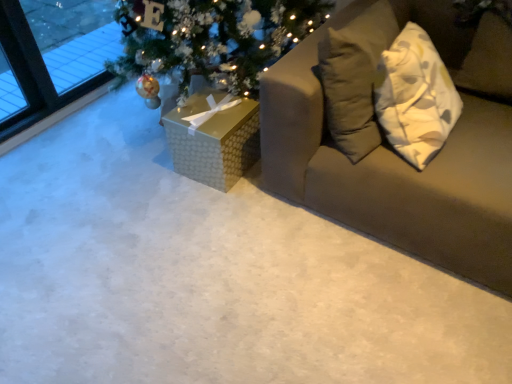
Question: From their relative heights in the image, would you say textured beige couch at right is taller or shorter than gold textured gift box at center?

Choices:
 (A) tall
 (B) short

Answer: (A)

Question: Considering the positions of textured beige couch at right and gold textured gift box at center in the image, is textured beige couch at right bigger or smaller than gold textured gift box at center?

Choices:
 (A) big
 (B) small

Answer: (A)

Question: From the image's perspective, relative to gold textured gift box at center, is textured beige couch at right above or below?

Choices:
 (A) below
 (B) above

Answer: (B)

Question: In terms of width, does gold textured gift box at center look wider or thinner when compared to textured beige couch at right?

Choices:
 (A) thin
 (B) wide

Answer: (A)

Question: Is point (195, 96) positioned closer to the camera than point (293, 160)?

Choices:
 (A) farther
 (B) closer

Answer: (A)

Question: Based on their sizes in the image, would you say gold textured gift box at center is bigger or smaller than textured beige couch at right?

Choices:
 (A) big
 (B) small

Answer: (B)

Question: Relative to textured beige couch at right, is gold textured gift box at center in front or behind?

Choices:
 (A) front
 (B) behind

Answer: (B)